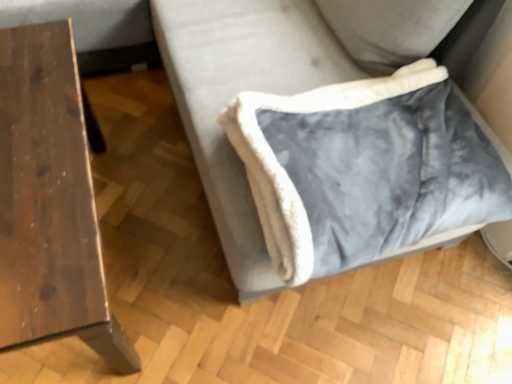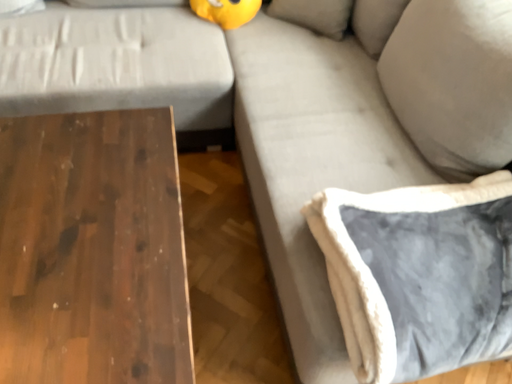
Question: How did the camera likely rotate when shooting the video?

Choices:
 (A) rotated downward
 (B) rotated upward

Answer: (B)